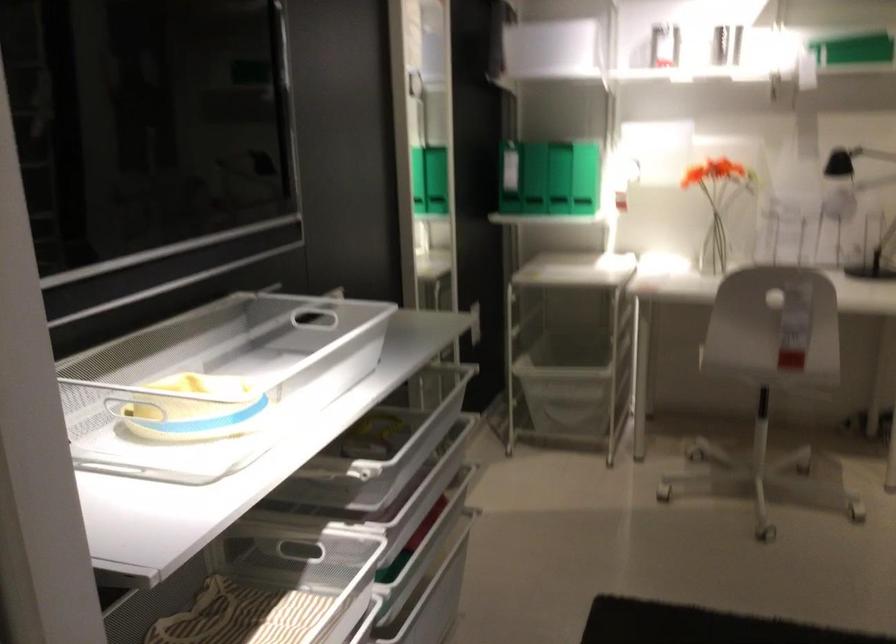
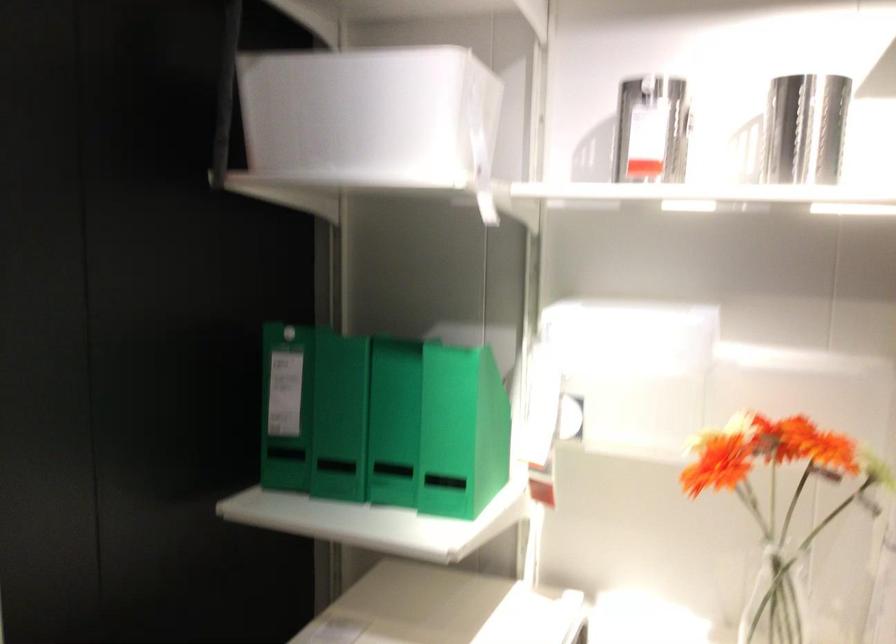
Where in the second image is the point corresponding to point (515, 167) from the first image?

(286, 406)